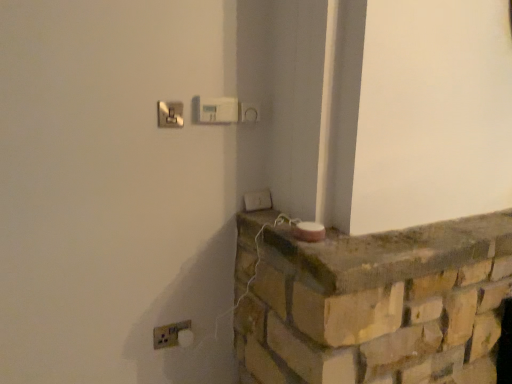
Question: From a real-world perspective, is matte silver switch at upper center, the 1th light switch in the left-to-right sequence, positioned above or below white plastic light switch at lower center, acting as the 3th light switch starting from the left?

Choices:
 (A) above
 (B) below

Answer: (A)

Question: From their relative heights in the image, would you say matte silver switch at upper center, the second light switch from the top, is taller or shorter than white plastic light switch at lower center, positioned as the first light switch in right-to-left order?

Choices:
 (A) tall
 (B) short

Answer: (A)

Question: Which is nearer to the rustic stone ledge at center?

Choices:
 (A) white plastic light switch at lower center, the 1th light switch positioned from the bottom
 (B) white plastic light switch at upper center, placed as the second light switch when sorted from front to back
 (C) white plastic electric outlet at lower left
 (D) matte silver switch at upper center, acting as the 1th light switch starting from the front

Answer: (A)

Question: Which is nearer to the matte silver switch at upper center, the second light switch ordered from the bottom?

Choices:
 (A) white plastic light switch at upper center, placed as the second light switch when sorted from front to back
 (B) white plastic light switch at lower center, positioned as the first light switch in right-to-left order
 (C) white plastic electric outlet at lower left
 (D) rustic stone ledge at center

Answer: (A)